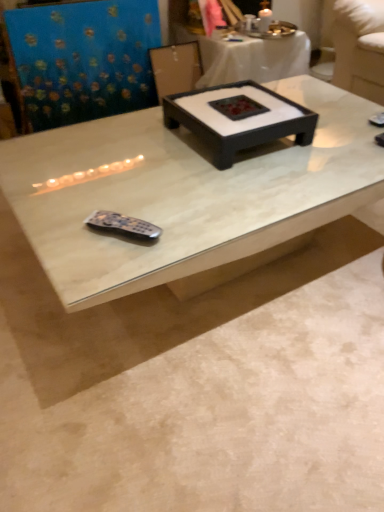
Image resolution: width=384 pixels, height=512 pixels. What do you see at coordinates (184, 193) in the screenshot?
I see `white marble coffee table at center, which is the 2th coffee table from right to left` at bounding box center [184, 193].

Identify the location of white marble coffee table at center, which appears as the first coffee table when viewed from the left. The width and height of the screenshot is (384, 512). (184, 193).

Find the location of a particular element. The image size is (384, 512). black matte tray at center, which ranks as the 2th coffee table in left-to-right order is located at coordinates (238, 118).

Measure the distance between black matte tray at center, the first coffee table viewed from the right, and camera.

The depth of black matte tray at center, the first coffee table viewed from the right, is 3.99 feet.

What do you see at coordinates (238, 118) in the screenshot? I see `black matte tray at center, the first coffee table viewed from the right` at bounding box center [238, 118].

This screenshot has width=384, height=512. In order to click on white marble coffee table at center, which appears as the first coffee table when viewed from the left in this screenshot , I will do `click(184, 193)`.

Which is more to the left, black matte tray at center, the first coffee table viewed from the right, or white marble coffee table at center, which appears as the first coffee table when viewed from the left?

white marble coffee table at center, which appears as the first coffee table when viewed from the left, is more to the left.

Is black matte tray at center, the first coffee table viewed from the right, closer to the viewer compared to white marble coffee table at center, which is the 2th coffee table from right to left?

No, black matte tray at center, the first coffee table viewed from the right, is further to the viewer.

Is point (206, 105) closer or farther from the camera than point (288, 233)?

Point (206, 105) is farther from the camera than point (288, 233).

In the scene shown: From the image's perspective, which one is positioned higher, black matte tray at center, which ranks as the 2th coffee table in left-to-right order, or white marble coffee table at center, which is the 2th coffee table from right to left?

black matte tray at center, which ranks as the 2th coffee table in left-to-right order, from the image's perspective.

From a real-world perspective, relative to white marble coffee table at center, which is the 2th coffee table from right to left, is black matte tray at center, which ranks as the 2th coffee table in left-to-right order, vertically above or below?

black matte tray at center, which ranks as the 2th coffee table in left-to-right order, is situated higher than white marble coffee table at center, which is the 2th coffee table from right to left, in the real world.

Which of these two, black matte tray at center, which ranks as the 2th coffee table in left-to-right order, or white marble coffee table at center, which appears as the first coffee table when viewed from the left, is thinner?

black matte tray at center, which ranks as the 2th coffee table in left-to-right order, is thinner.

Which of these two, black matte tray at center, the first coffee table viewed from the right, or white marble coffee table at center, which appears as the first coffee table when viewed from the left, stands shorter?

Standing shorter between the two is black matte tray at center, the first coffee table viewed from the right.

In the scene shown: Between black matte tray at center, which ranks as the 2th coffee table in left-to-right order, and white marble coffee table at center, which is the 2th coffee table from right to left, which one has smaller size?

With smaller size is black matte tray at center, which ranks as the 2th coffee table in left-to-right order.

Consider the image. Can we say black matte tray at center, which ranks as the 2th coffee table in left-to-right order, lies outside white marble coffee table at center, which appears as the first coffee table when viewed from the left?

Yes.

Is black matte tray at center, the first coffee table viewed from the right, in contact with white marble coffee table at center, which is the 2th coffee table from right to left?

black matte tray at center, the first coffee table viewed from the right, is not next to white marble coffee table at center, which is the 2th coffee table from right to left, and they're not touching.

Is black matte tray at center, which ranks as the 2th coffee table in left-to-right order, oriented away from white marble coffee table at center, which appears as the first coffee table when viewed from the left?

No, black matte tray at center, which ranks as the 2th coffee table in left-to-right order,'s orientation is not away from white marble coffee table at center, which appears as the first coffee table when viewed from the left.

How different are the orientations of black matte tray at center, the first coffee table viewed from the right, and white marble coffee table at center, which is the 2th coffee table from right to left, in degrees?

2.5 degrees separate the facing orientations of black matte tray at center, the first coffee table viewed from the right, and white marble coffee table at center, which is the 2th coffee table from right to left.

How much distance is there between black matte tray at center, the first coffee table viewed from the right, and white marble coffee table at center, which appears as the first coffee table when viewed from the left?

A distance of 7.87 inches exists between black matte tray at center, the first coffee table viewed from the right, and white marble coffee table at center, which appears as the first coffee table when viewed from the left.

This screenshot has width=384, height=512. Identify the location of coffee table directly beneath the black matte tray at center, the first coffee table viewed from the right (from a real-world perspective). (184, 193).

Is white marble coffee table at center, which is the 2th coffee table from right to left, to the right of black matte tray at center, which ranks as the 2th coffee table in left-to-right order, from the viewer's perspective?

Incorrect, white marble coffee table at center, which is the 2th coffee table from right to left, is not on the right side of black matte tray at center, which ranks as the 2th coffee table in left-to-right order.

Is the position of white marble coffee table at center, which is the 2th coffee table from right to left, more distant than that of black matte tray at center, which ranks as the 2th coffee table in left-to-right order?

No, it is not.

Between point (271, 149) and point (188, 98), which one is positioned behind?

The point (188, 98) is farther from the camera.

From the image's perspective, is white marble coffee table at center, which is the 2th coffee table from right to left, located beneath black matte tray at center, the first coffee table viewed from the right?

Indeed, from the image's perspective, white marble coffee table at center, which is the 2th coffee table from right to left, is shown beneath black matte tray at center, the first coffee table viewed from the right.

From a real-world perspective, which object stands above the other?

black matte tray at center, the first coffee table viewed from the right, is physically above.

Considering the sizes of white marble coffee table at center, which appears as the first coffee table when viewed from the left, and black matte tray at center, the first coffee table viewed from the right, in the image, is white marble coffee table at center, which appears as the first coffee table when viewed from the left, wider or thinner than black matte tray at center, the first coffee table viewed from the right,?

Clearly, white marble coffee table at center, which appears as the first coffee table when viewed from the left, has more width compared to black matte tray at center, the first coffee table viewed from the right.

Does white marble coffee table at center, which appears as the first coffee table when viewed from the left, have a lesser height compared to black matte tray at center, which ranks as the 2th coffee table in left-to-right order?

No, white marble coffee table at center, which appears as the first coffee table when viewed from the left, is not shorter than black matte tray at center, which ranks as the 2th coffee table in left-to-right order.

Based on their sizes in the image, would you say white marble coffee table at center, which is the 2th coffee table from right to left, is bigger or smaller than black matte tray at center, the first coffee table viewed from the right?

In the image, white marble coffee table at center, which is the 2th coffee table from right to left, appears to be larger than black matte tray at center, the first coffee table viewed from the right.

Is white marble coffee table at center, which appears as the first coffee table when viewed from the left, situated inside black matte tray at center, the first coffee table viewed from the right, or outside?

The correct answer is: outside.

Is white marble coffee table at center, which is the 2th coffee table from right to left, far from black matte tray at center, which ranks as the 2th coffee table in left-to-right order?

No, there isn't a large distance between white marble coffee table at center, which is the 2th coffee table from right to left, and black matte tray at center, which ranks as the 2th coffee table in left-to-right order.

Is white marble coffee table at center, which is the 2th coffee table from right to left, positioned with its back to black matte tray at center, the first coffee table viewed from the right?

No.

This screenshot has width=384, height=512. I want to click on coffee table that is on the left side of black matte tray at center, the first coffee table viewed from the right, so click(184, 193).

You are a GUI agent. You are given a task and a screenshot of the screen. Output one action in this format:
    pyautogui.click(x=<x>, y=<y>)
    Task: Click on the coffee table above the white marble coffee table at center, which appears as the first coffee table when viewed from the left (from the image's perspective)
    
    Given the screenshot: What is the action you would take?
    pyautogui.click(x=238, y=118)

Identify the location of coffee table located on the left of black matte tray at center, the first coffee table viewed from the right. Image resolution: width=384 pixels, height=512 pixels. (184, 193).